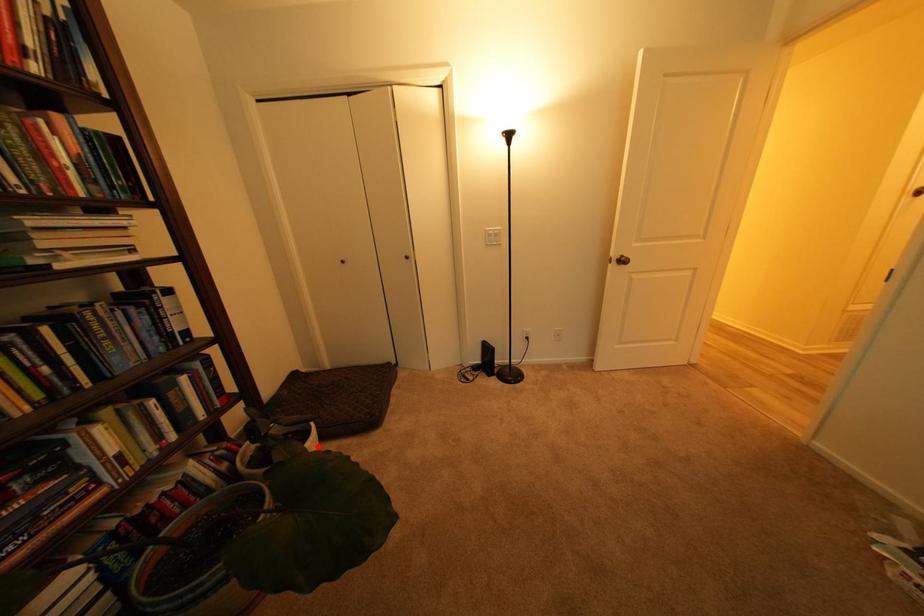
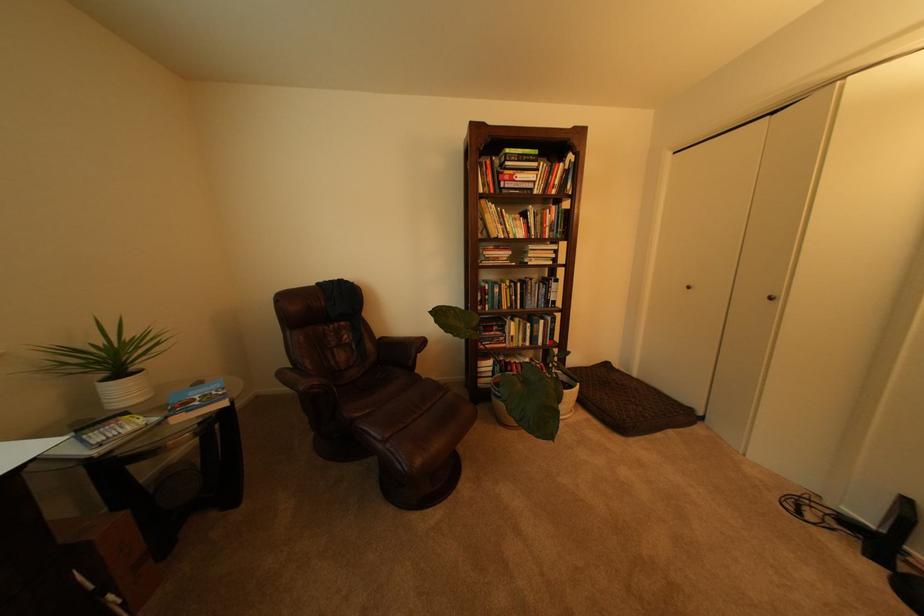
Question: I am providing you with two images of the same scene from different viewpoints. Given a red point in image1, look at the same physical point in image2. Is it:

Choices:
 (A) Closer to the viewpoint
 (B) Farther from the viewpoint

Answer: (B)